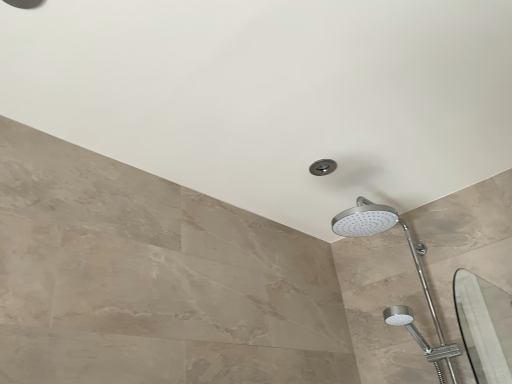
What is the approximate width of silver metallic shower head at upper right?

22.11 inches.

This screenshot has height=384, width=512. Describe the element at coordinates (413, 260) in the screenshot. I see `silver metallic shower head at upper right` at that location.

Where is `silver metallic shower head at upper right`? The image size is (512, 384). silver metallic shower head at upper right is located at coordinates (413, 260).

Where is `silver metallic shower head at upper right`? silver metallic shower head at upper right is located at coordinates click(413, 260).